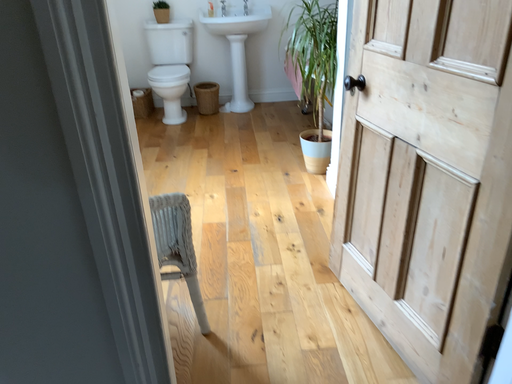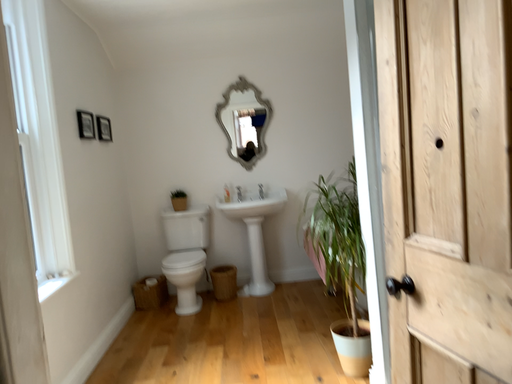
Question: Which way did the camera rotate in the video?

Choices:
 (A) rotated downward
 (B) rotated upward

Answer: (B)